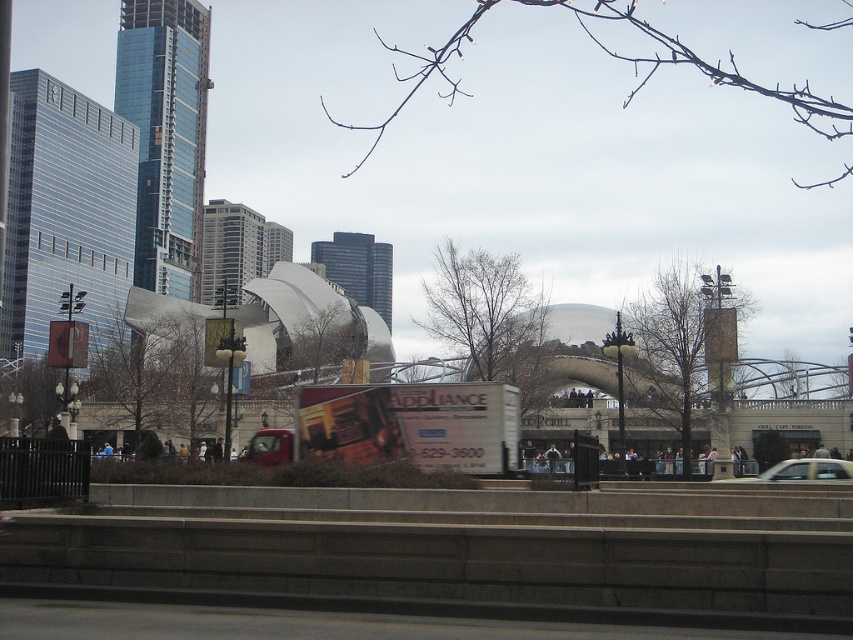
You are a delivery driver who needs to park your silver metallic car at center in a spot that allows you to see the white matte billboard at center. Is the billboard above the car visible from the driver seat?

The white matte billboard at center is located above the silver metallic car at center, so yes, the driver can see the billboard from the driver seat.

You are standing at point A located at point A at point (821,474). You want to walk to point B located at point B at point 0.258, 0.036. The path between them is a straight line. Given that the walkway has a 100 feet limit for pedestrians, will you be able to reach point B without exceeding the limit?

The distance between point A at point (821,474) and point B at point 0.258, 0.036 is 97.76 feet, which is under the 100 feet limit. Therefore, you can reach point B without exceeding the limit.

You are a delivery driver arriving at the urban scene. You need to park your metallic red truck at center without blocking the white matte billboard at center. Is this possible?

The white matte billboard at center is located above the metallic red truck at center, so parking the metallic red truck at center won t block the billboard since it is positioned below it.